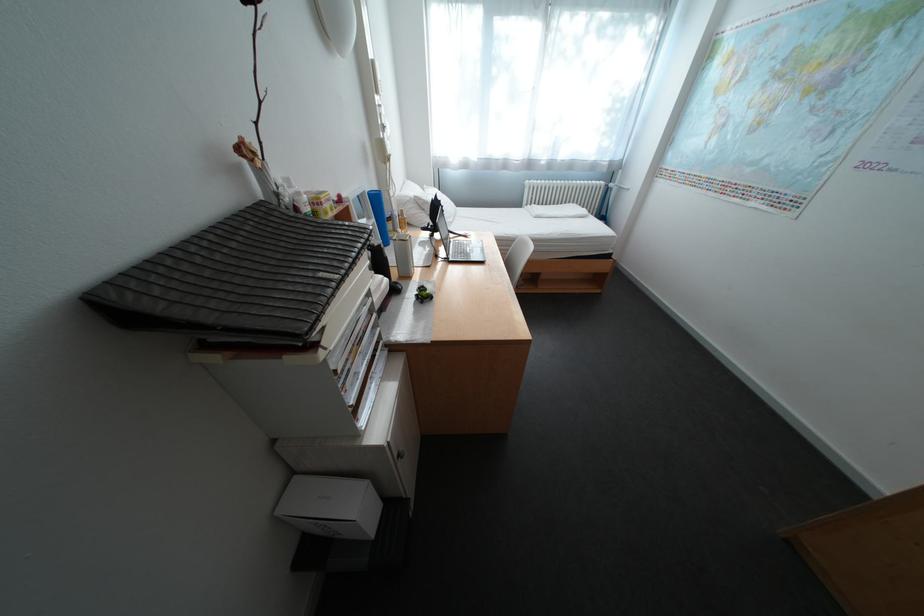
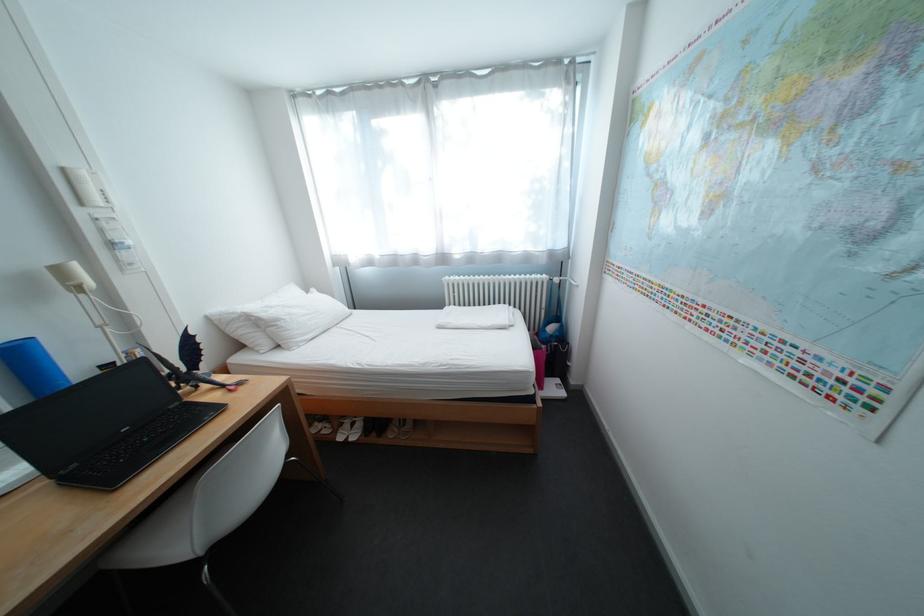
What movement of the cameraman would produce the second image?

The cameraman walked toward right, forward.